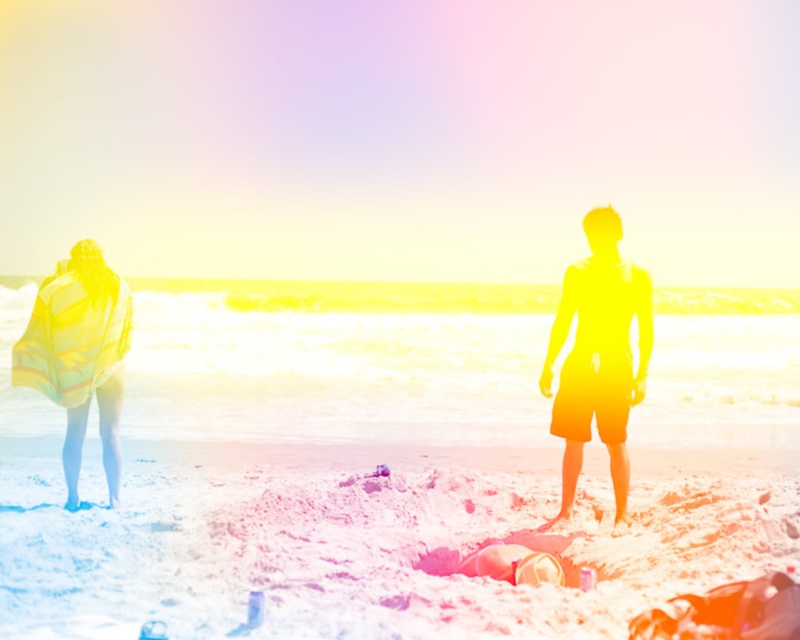
This screenshot has height=640, width=800. Describe the element at coordinates (598, 355) in the screenshot. I see `silhouette shorts at center` at that location.

Is silhouette shorts at center positioned before yellow striped towel at left?

Yes, silhouette shorts at center is closer to the viewer.

What do you see at coordinates (598, 355) in the screenshot? The height and width of the screenshot is (640, 800). I see `silhouette shorts at center` at bounding box center [598, 355].

Find the location of a particular element. silhouette shorts at center is located at coordinates (598, 355).

Can you confirm if white sandy beach at center is positioned below yellow striped towel at left?

Correct, white sandy beach at center is located below yellow striped towel at left.

Is point (498, 481) positioned in front of point (124, 307)?

No, (498, 481) is further to viewer.

Where is `white sandy beach at center`? This screenshot has height=640, width=800. white sandy beach at center is located at coordinates (486, 547).

Does white sandy beach at center come in front of silhouette shorts at center?

Yes, white sandy beach at center is closer to the viewer.

You are a GUI agent. You are given a task and a screenshot of the screen. Output one action in this format:
    pyautogui.click(x=<x>, y=<y>)
    Task: Click on the white sandy beach at center
    The height and width of the screenshot is (640, 800).
    Given the screenshot: What is the action you would take?
    pyautogui.click(x=486, y=547)

Identify the location of white sandy beach at center. (486, 547).